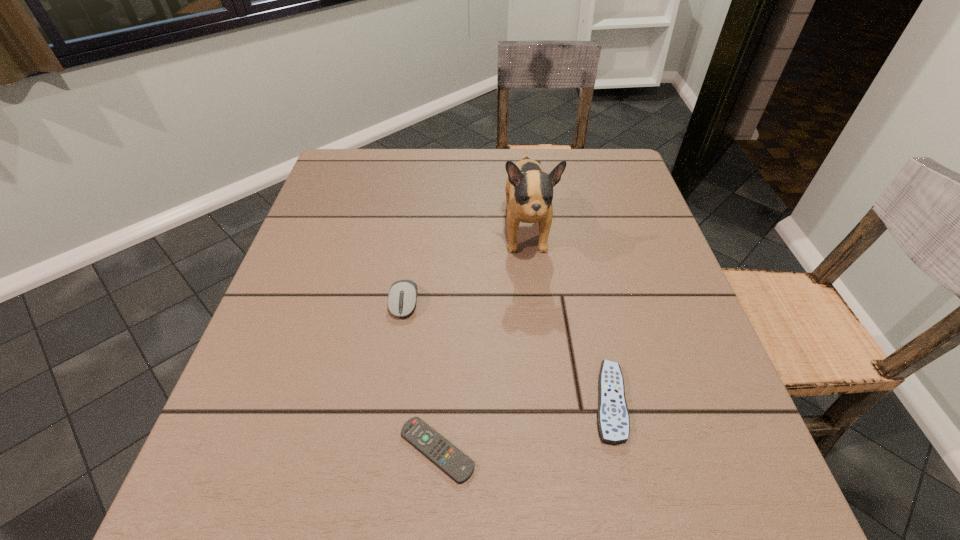
The image size is (960, 540). I want to click on object that is the closest to the shortest object, so click(613, 420).

The width and height of the screenshot is (960, 540). What are the coordinates of `blank area in the image that satisfies the following two spatial constraints: 1. at the face of the rightmost object; 2. on the left side of the puppy` in the screenshot? It's located at (544, 402).

Identify the location of vacant region that satisfies the following two spatial constraints: 1. on the wheel side of the second farthest object; 2. on the right side of the rightmost object. (389, 402).

This screenshot has width=960, height=540. I want to click on vacant space that satisfies the following two spatial constraints: 1. at the face of the second shortest object; 2. on the right side of the tallest object, so click(x=544, y=402).

Identify the location of vacant space that satisfies the following two spatial constraints: 1. on the wheel side of the shortest object; 2. on the right side of the third shortest object. The height and width of the screenshot is (540, 960). (381, 450).

Locate an element on the screen. Image resolution: width=960 pixels, height=540 pixels. blank area in the image that satisfies the following two spatial constraints: 1. on the wheel side of the third tallest object; 2. on the right side of the computer equipment is located at coordinates (389, 402).

This screenshot has height=540, width=960. Identify the location of blank space that satisfies the following two spatial constraints: 1. at the face of the tallest object; 2. on the left side of the taller remote control. (544, 402).